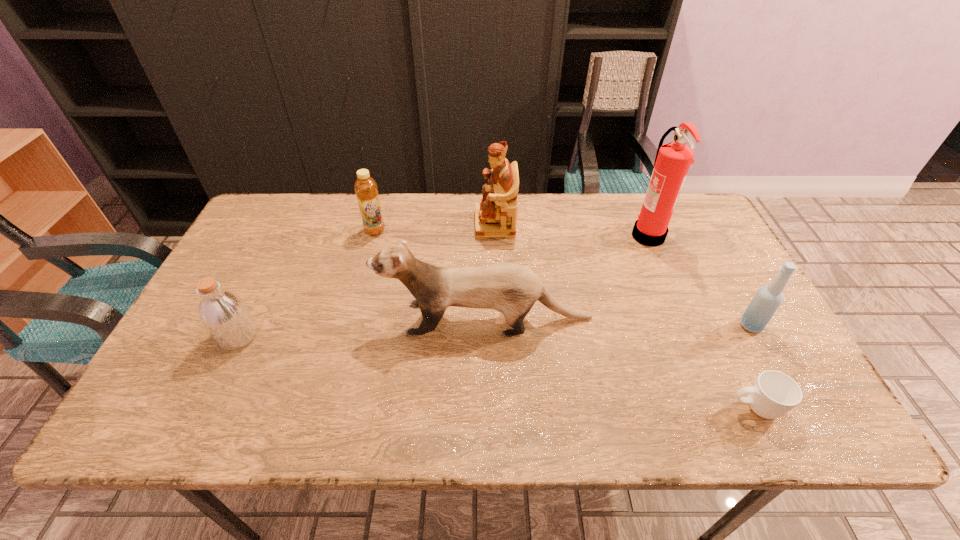
The width and height of the screenshot is (960, 540). What are the coordinates of `free space located with the nozzle aimed from the fire extinguisher` in the screenshot? It's located at (596, 235).

This screenshot has width=960, height=540. Find the location of `vacant space located with the nozzle aimed from the fire extinguisher`. vacant space located with the nozzle aimed from the fire extinguisher is located at coordinates (609, 235).

Locate an element on the screen. The height and width of the screenshot is (540, 960). vacant position located on the front-facing side of the figurine is located at coordinates (371, 224).

This screenshot has height=540, width=960. Find the location of `free space located on the front-facing side of the figurine`. free space located on the front-facing side of the figurine is located at coordinates (361, 224).

In order to click on vacant area situated 0.210m on the front-facing side of the figurine in this screenshot , I will do `click(408, 224)`.

Where is `vacant region located 0.110m on the face of the ferret`? Image resolution: width=960 pixels, height=540 pixels. vacant region located 0.110m on the face of the ferret is located at coordinates (336, 319).

Identify the location of vacant area situated on the face of the ferret. (229, 319).

The image size is (960, 540). Find the location of `free space located on the face of the ferret`. free space located on the face of the ferret is located at coordinates (308, 319).

Identify the location of vacant region located 0.070m on the left of the second bottle from right to left. (342, 231).

Where is `vacant space located 0.240m on the left of the rightmost object`? vacant space located 0.240m on the left of the rightmost object is located at coordinates (643, 326).